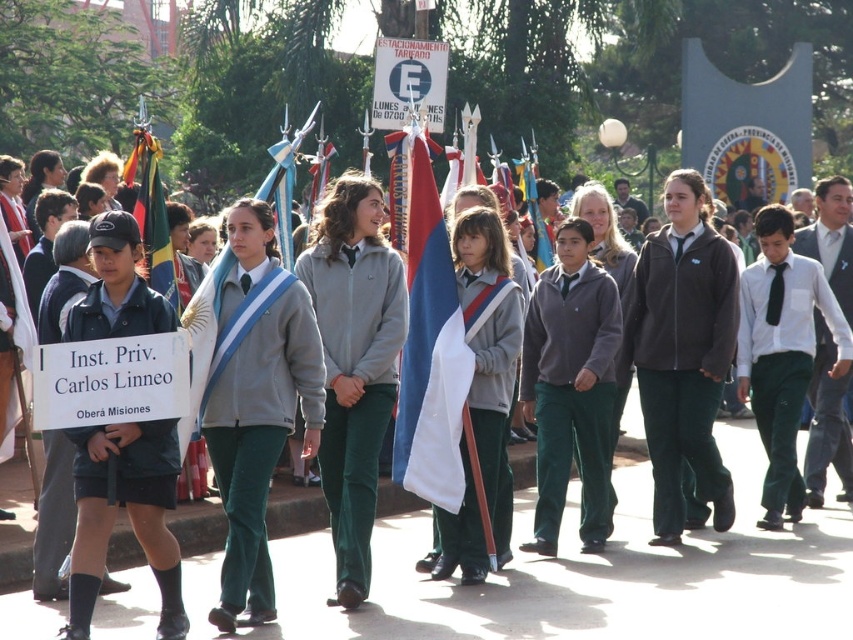
You are a photographer trying to capture a clear photo of the dark blue uniform at center and the white cotton shirt at center. Based on their heights, which one should you focus on first to ensure both are in frame?

The dark blue uniform at center is much taller than the white cotton shirt at center, so you should focus on the dark blue uniform at center first to ensure both are in frame.

You are a photographer trying to capture the student in the dark blue uniform at center. The camera is focused on the point at coordinates [128,513]. Is this point likely to be on the student wearing the dark blue uniform at center?

Yes, the point at coordinates [128,513] corresponds to the dark blue uniform at center, so the camera is focused on that student.

Looking at this image, you are a photographer trying to capture a clear shot of both the green fabric pants at center and the white fabric sash at center. Based on their positions, which one should you focus on first to ensure both are in focus?

You should focus on the green fabric pants at center first since it is closer to you than the white fabric sash at center, ensuring both will be in focus if the depth of field is sufficient.